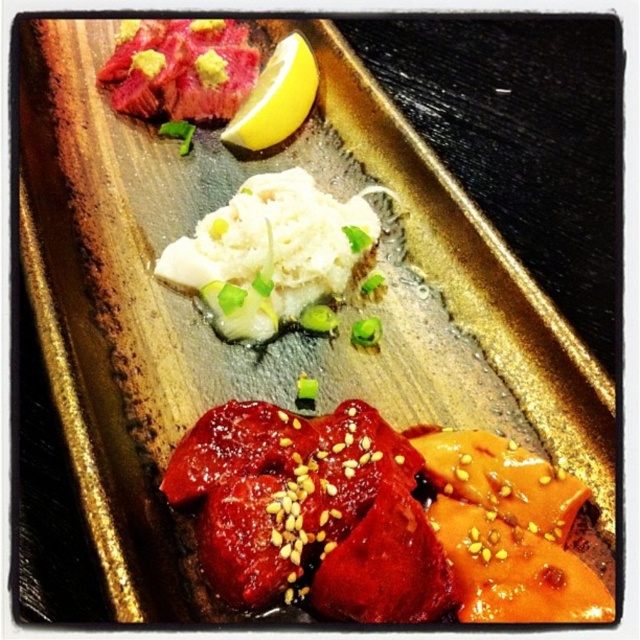
You are a food critic evaluating this dish. You notice two points on the plate marked as point 1 at coordinates [278,304] and point 2 at coordinates [305,76]. Which point is closer to you as you look at the dish?

Point 1 at coordinates [278,304] is closer to the viewer than point 2 at coordinates [305,76].

You are a food critic evaluating the presentation of this dish. Based on the height difference between the white fluffy rice at center and the yellow matte lemon at upper center, which object appears taller from the viewer perspective?

The white fluffy rice at center appears taller than the yellow matte lemon at upper center because it has a greater height according to the description.